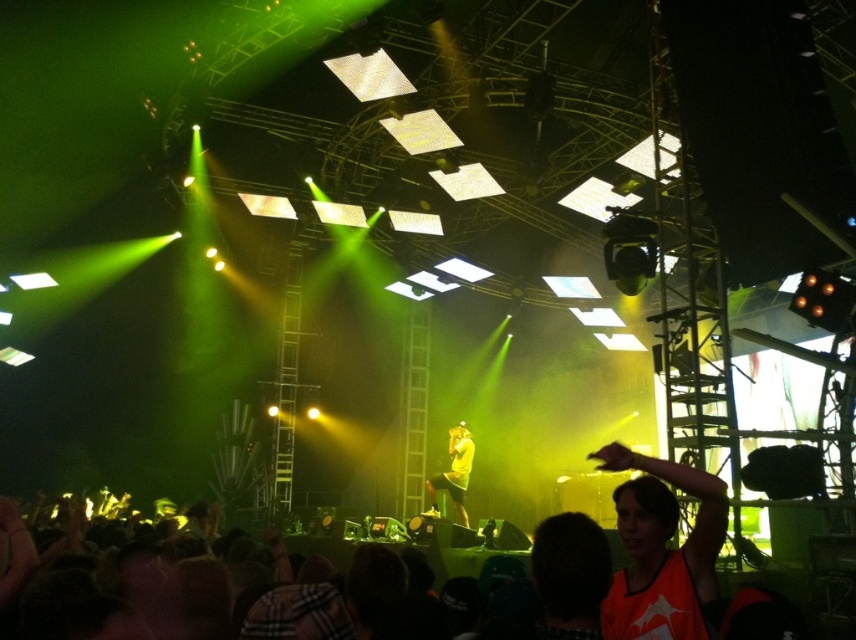
Does orange jersey at lower right have a smaller size compared to yellow matte shirt at center?

Indeed, orange jersey at lower right has a smaller size compared to yellow matte shirt at center.

Between point (690, 547) and point (452, 486), which one is positioned behind?

The point (452, 486) is more distant.

At what (x,y) coordinates should I click in order to perform the action: click on orange jersey at lower right. Please return your answer as a coordinate pair (x, y). This screenshot has width=856, height=640. Looking at the image, I should click on (661, 547).

At what (x,y) coordinates should I click in order to perform the action: click on orange jersey at lower right. Please return your answer as a coordinate pair (x, y). This screenshot has height=640, width=856. Looking at the image, I should click on (661, 547).